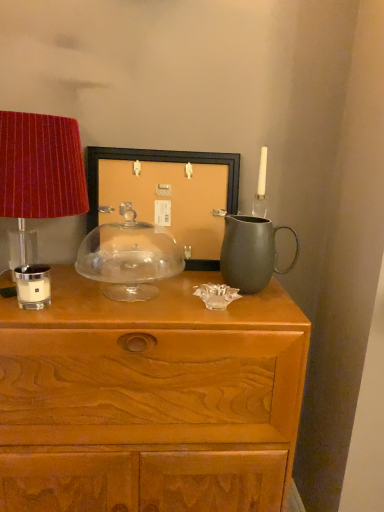
I want to click on free space that is to the left of matte gray jug at right, so click(x=190, y=294).